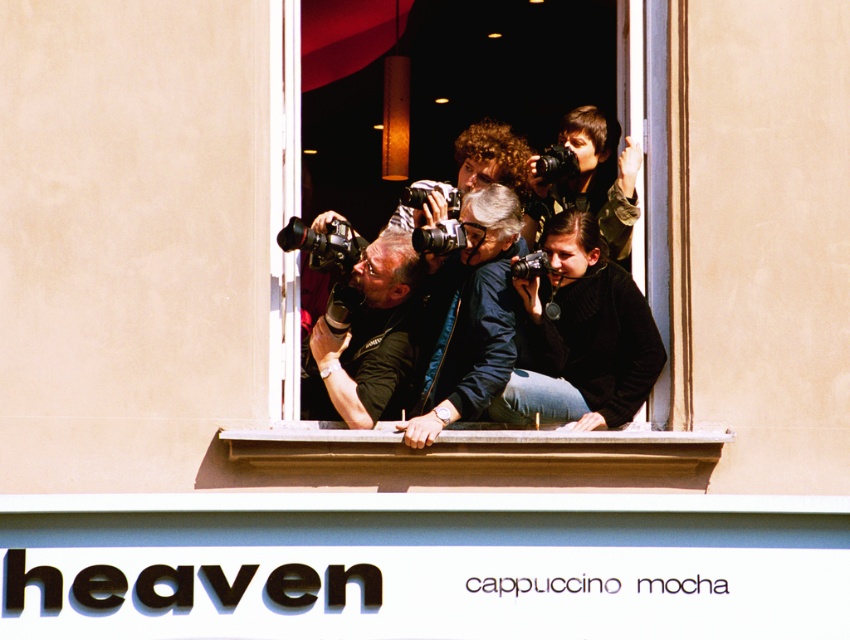
Can you confirm if transparent glass window at center is positioned above matte black camera at center?

No.

Between transparent glass window at center and matte black camera at center, which one has less height?

transparent glass window at center is shorter.

Describe the element at coordinates (326, 438) in the screenshot. I see `transparent glass window at center` at that location.

I want to click on transparent glass window at center, so click(x=326, y=438).

Is transparent glass window at center to the right of smooth concrete window sill at center from the viewer's perspective?

Correct, you'll find transparent glass window at center to the right of smooth concrete window sill at center.

Measure the distance between transparent glass window at center and smooth concrete window sill at center.

transparent glass window at center is 5.57 feet from smooth concrete window sill at center.

Where is `transparent glass window at center`? The image size is (850, 640). transparent glass window at center is located at coordinates (326, 438).

I want to click on transparent glass window at center, so click(326, 438).

Between transparent glass window at center and blue fabric jacket at center, which one has more height?

Standing taller between the two is blue fabric jacket at center.

Does transparent glass window at center have a larger size compared to blue fabric jacket at center?

No, transparent glass window at center is not bigger than blue fabric jacket at center.

Which is behind, point (344, 456) or point (468, 308)?

The point (468, 308) is more distant.

What are the coordinates of `transparent glass window at center` in the screenshot? It's located at (326, 438).